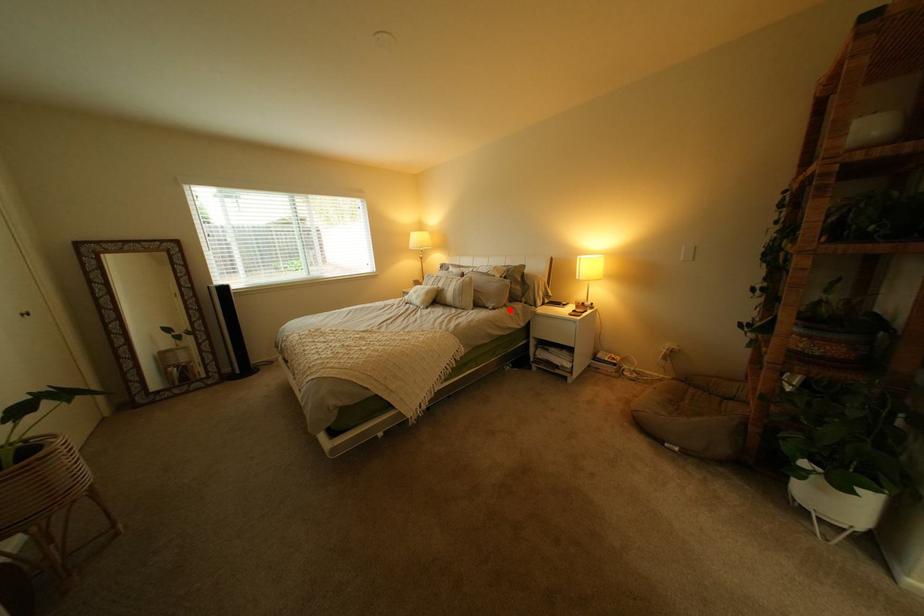
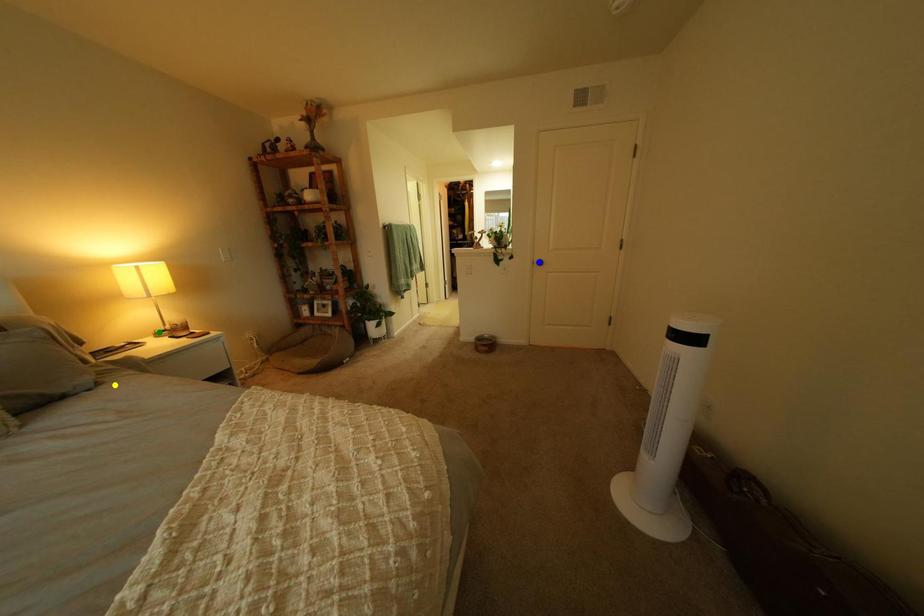
Question: I am providing you with two images of the same scene from different viewpoints. A red point is marked on the first image. You are given multiple points on the second image. Which spot in image 2 lines up with the point in image 1?

Choices:
 (A) green point
 (B) blue point
 (C) yellow point

Answer: (C)